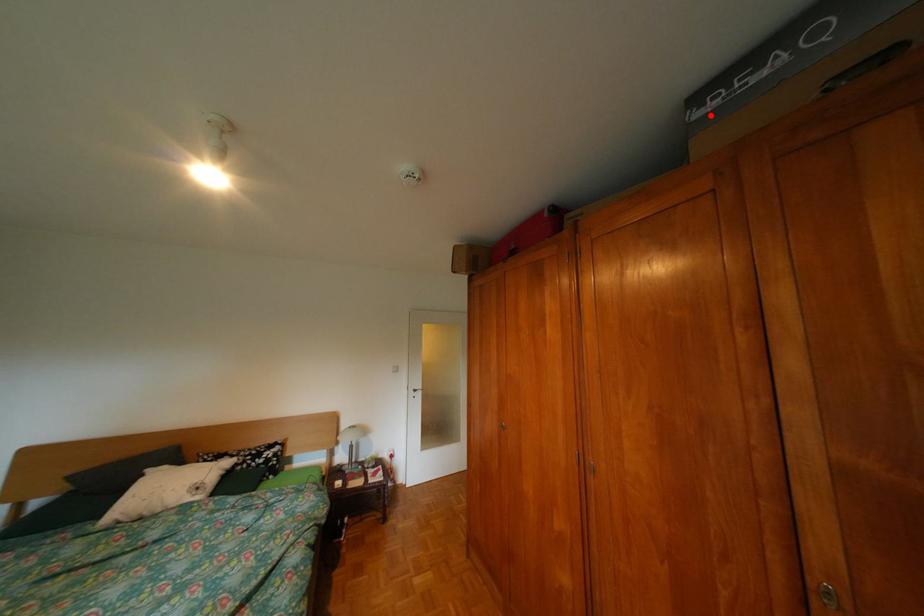
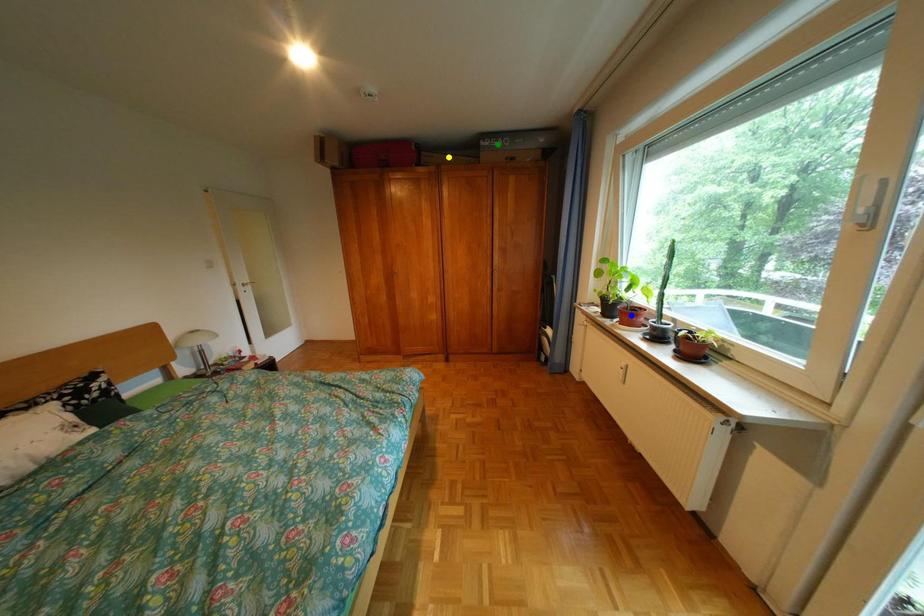
Question: I am providing you with two images of the same scene from different viewpoints. A red point is marked on the first image. You are given multiple points on the second image. In image 2, which mark is for the same physical point as the one in image 1?

Choices:
 (A) blue point
 (B) yellow point
 (C) green point

Answer: (C)